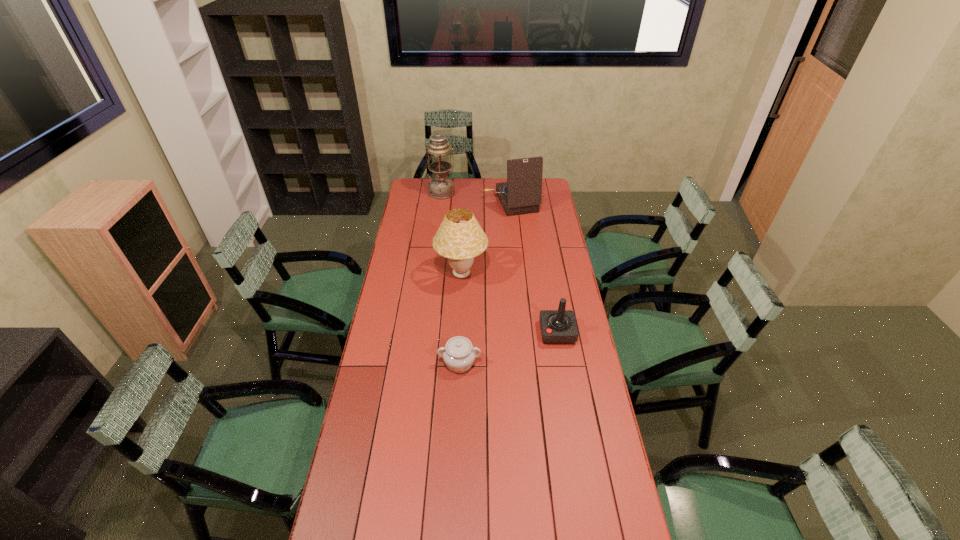
Where is `vacant space located on the front-facing side of the second nearest object`? vacant space located on the front-facing side of the second nearest object is located at coordinates (523, 333).

Locate an element on the screen. This screenshot has height=540, width=960. free spot located 0.130m on the front-facing side of the second nearest object is located at coordinates (509, 333).

Find the location of a particular element. vacant space positioned 0.390m on the front-facing side of the second nearest object is located at coordinates (447, 333).

Locate an element on the screen. vacant space located 0.390m on the right of the shortest object is located at coordinates (580, 363).

I want to click on oil lamp located in the far edge section of the desktop, so click(x=441, y=186).

Locate an element on the screen. phonograph record positioned at the far edge is located at coordinates (522, 193).

Identify the location of object that is at the left edge. The height and width of the screenshot is (540, 960). (441, 186).

Identify the location of phonograph record that is at the right edge. The height and width of the screenshot is (540, 960). (522, 193).

Image resolution: width=960 pixels, height=540 pixels. What are the coordinates of `joystick present at the right edge` in the screenshot? It's located at (559, 326).

At what (x,y) coordinates should I click in order to perform the action: click on object positioned at the far left corner. Please return your answer as a coordinate pair (x, y). This screenshot has height=540, width=960. Looking at the image, I should click on [441, 186].